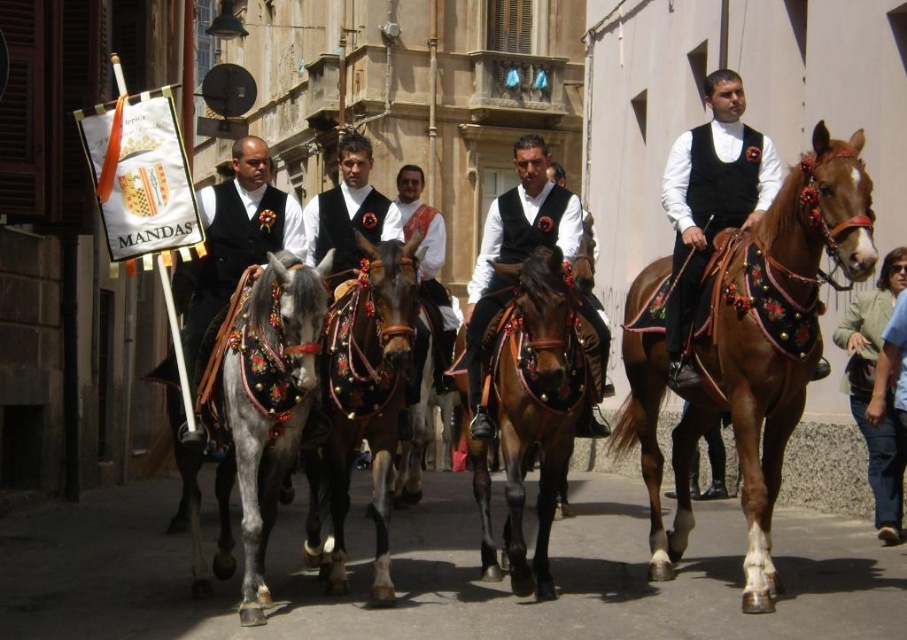
Does brown leather horse at right have a greater height compared to matte black vest at center?

Yes.

Describe the element at coordinates (752, 349) in the screenshot. I see `brown leather horse at right` at that location.

Identify the location of brown leather horse at right. The image size is (907, 640). (752, 349).

Is the position of gray glossy horse at left less distant than that of green fabric jacket at lower right?

Yes, it is in front of green fabric jacket at lower right.

Between point (311, 269) and point (862, 298), which one is positioned behind?

Point (862, 298)

Where is `gray glossy horse at left`? Image resolution: width=907 pixels, height=640 pixels. gray glossy horse at left is located at coordinates (262, 404).

Who is positioned more to the right, shiny black vest at center or white satin vest at center?

shiny black vest at center

Does shiny black vest at center have a greater height compared to white satin vest at center?

No.

This screenshot has width=907, height=640. Identify the location of shiny black vest at center. (515, 252).